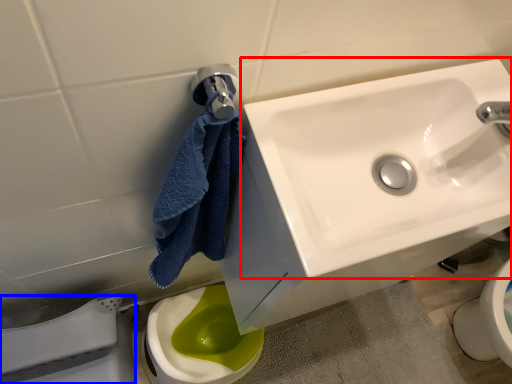
Question: Which of the following is the farthest to the observer, sink (highlighted by a red box) or porcelain (highlighted by a blue box)?

Choices:
 (A) sink
 (B) porcelain

Answer: (B)